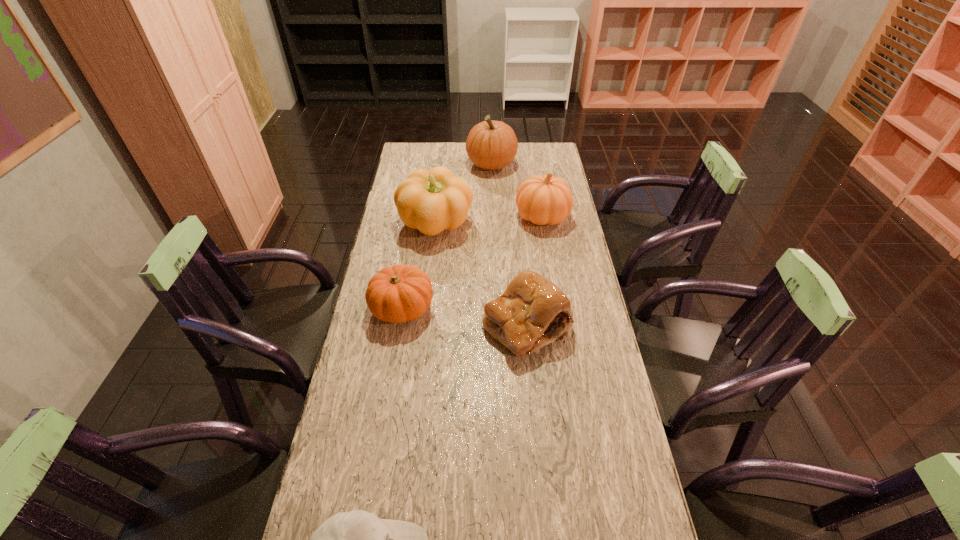
Image resolution: width=960 pixels, height=540 pixels. Identify the location of bread that is at the right edge. (532, 312).

This screenshot has width=960, height=540. I want to click on free space at the left edge of the desktop, so click(x=385, y=397).

Find the location of a particular element. vacant region at the right edge is located at coordinates click(575, 351).

The height and width of the screenshot is (540, 960). In the image, there is a desktop. In order to click on free region at the far right corner in this screenshot , I will do `click(555, 146)`.

Image resolution: width=960 pixels, height=540 pixels. Find the location of `unoccupied position between the bread and the nearest pumpkin`. unoccupied position between the bread and the nearest pumpkin is located at coordinates [x=465, y=316].

I want to click on unoccupied position between the bread and the shortest pumpkin, so click(x=465, y=316).

Choose which object is the second nearest neighbor to the bread. Please provide its 2D coordinates. Your answer should be formatted as a tuple, i.e. [(x, y)], where the tuple contains the x and y coordinates of a point satisfying the conditions above.

[(433, 200)]

The image size is (960, 540). What are the coordinates of `the fourth closest object relative to the nearest pumpkin` in the screenshot? It's located at (358, 539).

Locate which pumpkin ranks in proximity to the shortest pumpkin. Please provide its 2D coordinates. Your answer should be formatted as a tuple, i.e. [(x, y)], where the tuple contains the x and y coordinates of a point satisfying the conditions above.

[(433, 200)]

Point out which pumpkin is positioned as the nearest to the farthest pumpkin. Please provide its 2D coordinates. Your answer should be formatted as a tuple, i.e. [(x, y)], where the tuple contains the x and y coordinates of a point satisfying the conditions above.

[(545, 199)]